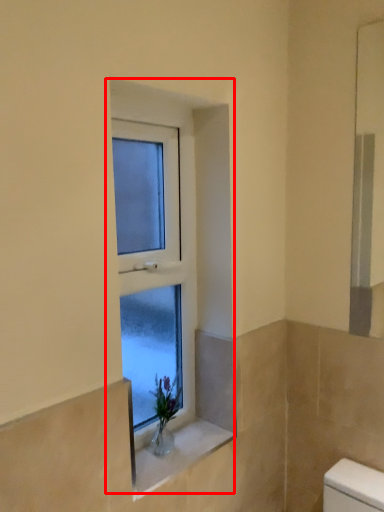
Question: From the image's perspective, what is the correct spatial relationship of window (annotated by the red box) in relation to window sill?

Choices:
 (A) above
 (B) below

Answer: (A)